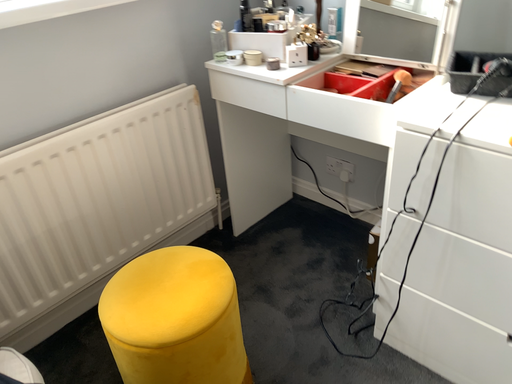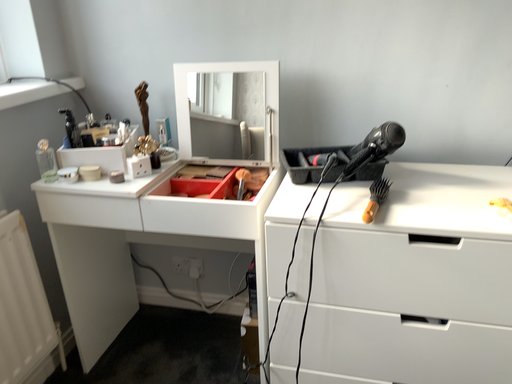
Question: How did the camera likely rotate when shooting the video?

Choices:
 (A) rotated downward
 (B) rotated upward

Answer: (B)